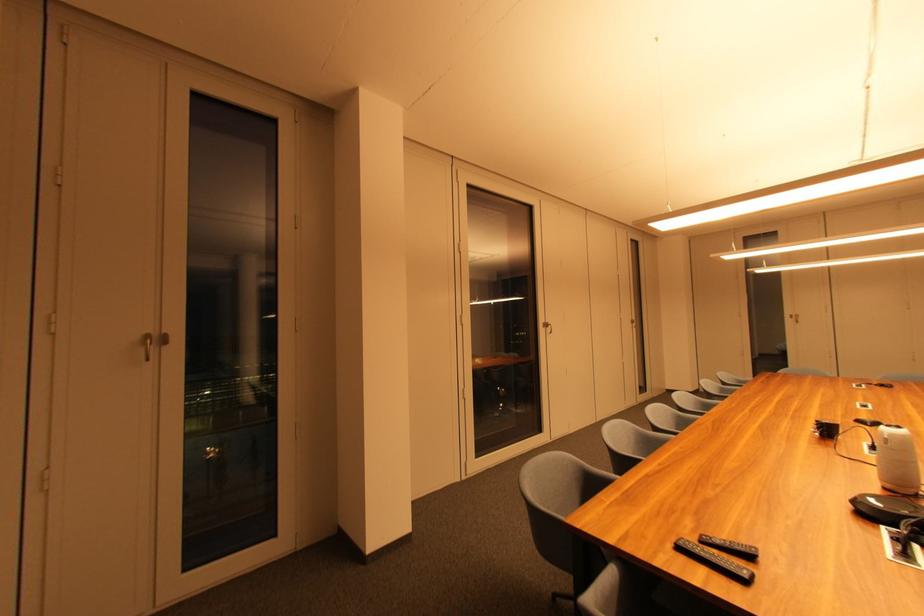
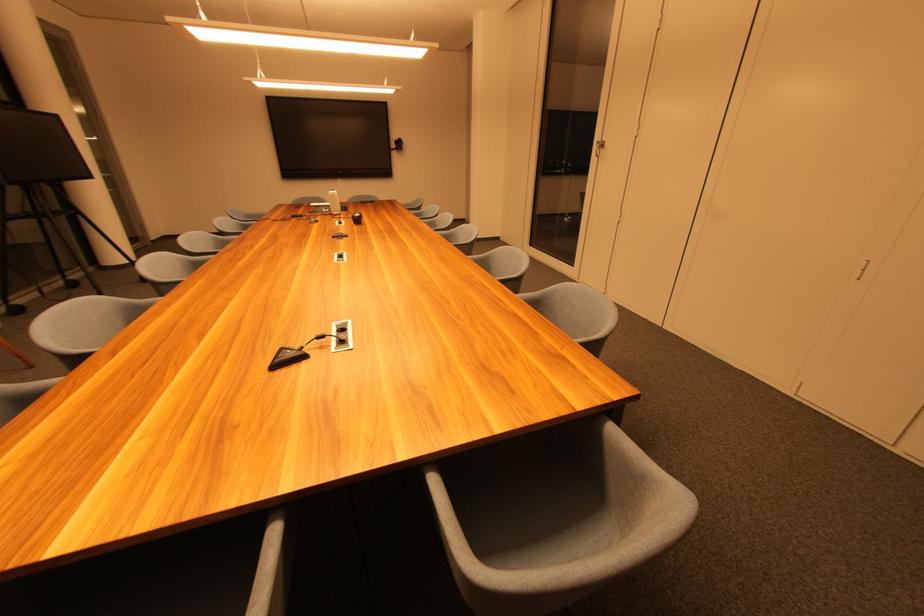
In the second image, find the point that corresponds to the point at 546,322 in the first image.

(602, 140)